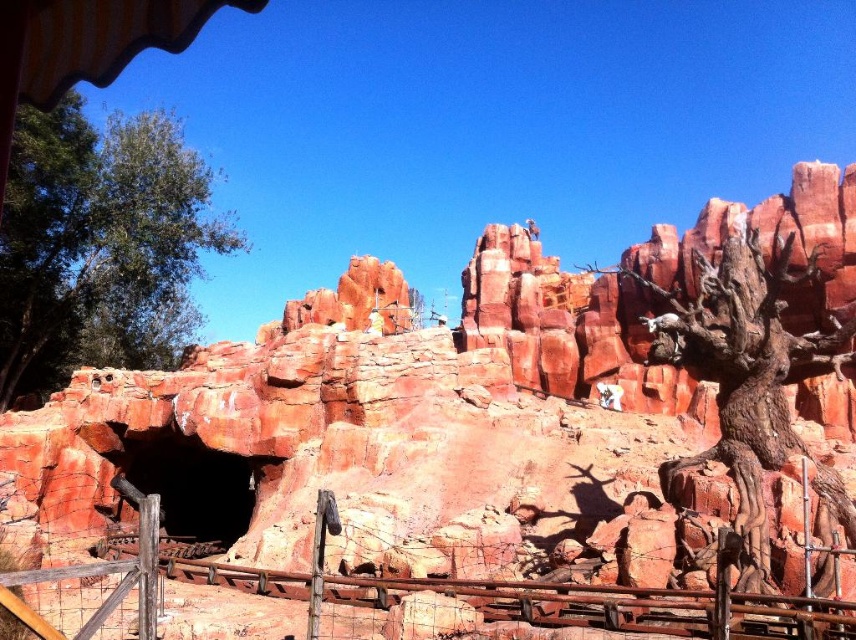
Does green leafy tree at left have a greater height compared to rusty metal fence at lower center?

Yes, green leafy tree at left is taller than rusty metal fence at lower center.

Who is positioned more to the right, green leafy tree at left or rusty metal fence at lower center?

Positioned to the right is rusty metal fence at lower center.

Does point (98, 326) come in front of point (447, 589)?

No, (98, 326) is behind (447, 589).

Where is `green leafy tree at left`? green leafy tree at left is located at coordinates (99, 243).

Is rustic stone rock formation at center to the right of green leafy tree at left from the viewer's perspective?

Yes, rustic stone rock formation at center is to the right of green leafy tree at left.

Is rustic stone rock formation at center shorter than green leafy tree at left?

Incorrect, rustic stone rock formation at center's height does not fall short of green leafy tree at left's.

Identify the location of rustic stone rock formation at center. Image resolution: width=856 pixels, height=640 pixels. (397, 432).

Is rustic stone rock formation at center behind rustic bark tree at right?

Yes, rustic stone rock formation at center is further from the viewer.

From the picture: Between rustic stone rock formation at center and rustic bark tree at right, which one appears on the right side from the viewer's perspective?

From the viewer's perspective, rustic bark tree at right appears more on the right side.

Is point (824, 188) closer to camera compared to point (770, 436)?

No, (824, 188) is further to viewer.

The width and height of the screenshot is (856, 640). In order to click on rustic stone rock formation at center in this screenshot , I will do `click(397, 432)`.